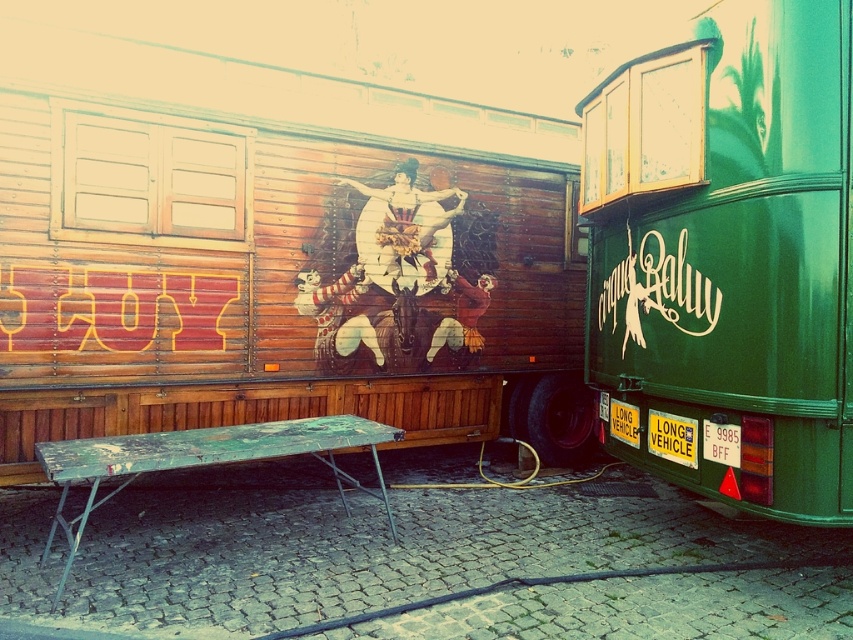
You are a delivery person needing to park your van between the green glossy trailer at right and the white plastic sign at center. Can your van, which is 2 meters wide, fit in the space between them?

The green glossy trailer at right is wider than the white plastic sign at center. However, the exact width of the space between them isn t provided. Without knowing the distance between the two objects, it s impossible to determine if the 2 meter wide van can fit.

You are setting up a booth at a fairground and need to place a banner between the wooden table at lower left and the yellow plastic sign at lower right. Which object should the banner be placed closer to if it needs to be at eye level for visitors?

The banner should be placed closer to the wooden table at lower left because it is taller than the yellow plastic sign at lower right, so positioning it near the taller object would keep it at an appropriate eye level.

From the picture: You are standing in a park and see the rusty metal picnic table at center. You want to place a 2.5 meter long picnic blanket on the ground in front of it. Can you fit the entire picnic blanket in front of the picnic table without overlapping it?

The rusty metal picnic table at center is 3.19 meters away from the viewer. Since the picnic blanket is 2.5 meters long, it can be placed in front of the picnic table without overlapping as the distance is sufficient.